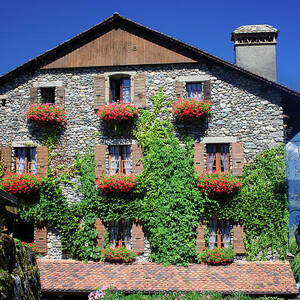
The height and width of the screenshot is (300, 300). I want to click on shutter, so click(x=34, y=166).